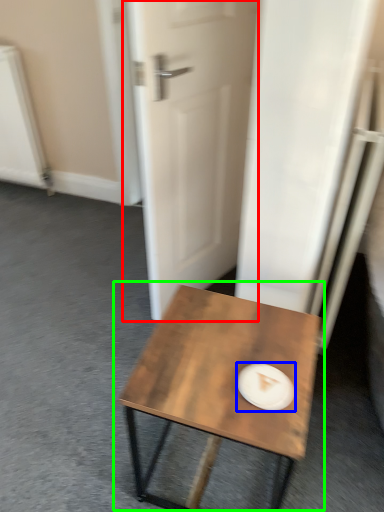
Question: Which object is the farthest from door (highlighted by a red box)? Choose among these: paper plate (highlighted by a blue box) or coffee table (highlighted by a green box).

Choices:
 (A) paper plate
 (B) coffee table

Answer: (A)